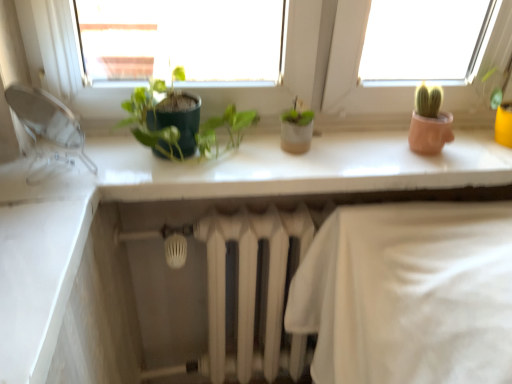
Question: Considering the relative positions of transparent plastic faucet at left and white glossy counter top at upper center in the image provided, is transparent plastic faucet at left to the right of white glossy counter top at upper center from the viewer's perspective?

Choices:
 (A) no
 (B) yes

Answer: (A)

Question: Considering the relative sizes of transparent plastic faucet at left and white glossy counter top at upper center in the image provided, is transparent plastic faucet at left smaller than white glossy counter top at upper center?

Choices:
 (A) no
 (B) yes

Answer: (B)

Question: Does transparent plastic faucet at left lie in front of white glossy counter top at upper center?

Choices:
 (A) no
 (B) yes

Answer: (B)

Question: Is transparent plastic faucet at left at the left side of white glossy counter top at upper center?

Choices:
 (A) no
 (B) yes

Answer: (B)

Question: Is white glossy counter top at upper center completely or partially inside transparent plastic faucet at left?

Choices:
 (A) no
 (B) yes

Answer: (A)

Question: Is transparent plastic faucet at left positioned far away from white glossy counter top at upper center?

Choices:
 (A) no
 (B) yes

Answer: (A)

Question: From a real-world perspective, is green matte plant at center physically below transparent plastic faucet at left?

Choices:
 (A) no
 (B) yes

Answer: (A)

Question: From a real-world perspective, is green matte plant at center physically above transparent plastic faucet at left?

Choices:
 (A) no
 (B) yes

Answer: (B)

Question: Is green matte plant at center far away from transparent plastic faucet at left?

Choices:
 (A) yes
 (B) no

Answer: (B)

Question: Can you confirm if green matte plant at center is smaller than transparent plastic faucet at left?

Choices:
 (A) yes
 (B) no

Answer: (B)

Question: Is green matte plant at center with transparent plastic faucet at left?

Choices:
 (A) no
 (B) yes

Answer: (A)

Question: Is green matte plant at center positioned behind transparent plastic faucet at left?

Choices:
 (A) yes
 (B) no

Answer: (A)

Question: Does white glossy counter top at upper center come behind transparent plastic faucet at left?

Choices:
 (A) no
 (B) yes

Answer: (B)